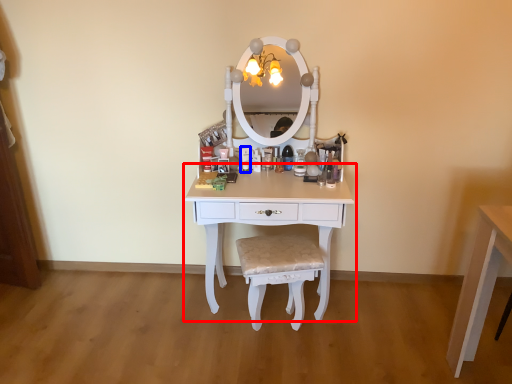
Question: Which point is closer to the camera, table (highlighted by a red box) or toiletry (highlighted by a blue box)?

Choices:
 (A) table
 (B) toiletry

Answer: (A)